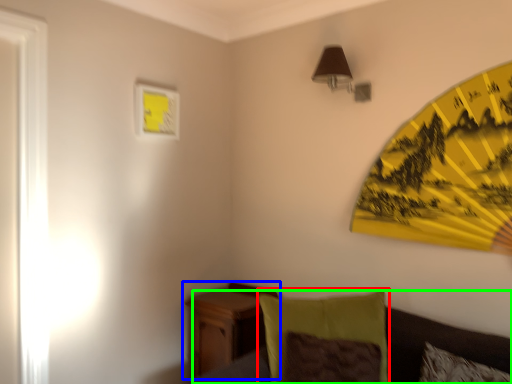
Question: Which is nearer to the pillow (highlighted by a red box)? nightstand (highlighted by a blue box) or couch (highlighted by a green box).

Choices:
 (A) nightstand
 (B) couch

Answer: (B)